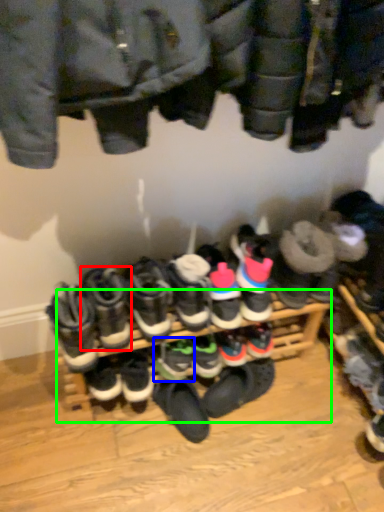
Question: Which object is positioned farthest from footwear (highlighted by a red box)? Select from footwear (highlighted by a blue box) and shelf (highlighted by a green box).

Choices:
 (A) footwear
 (B) shelf

Answer: (B)